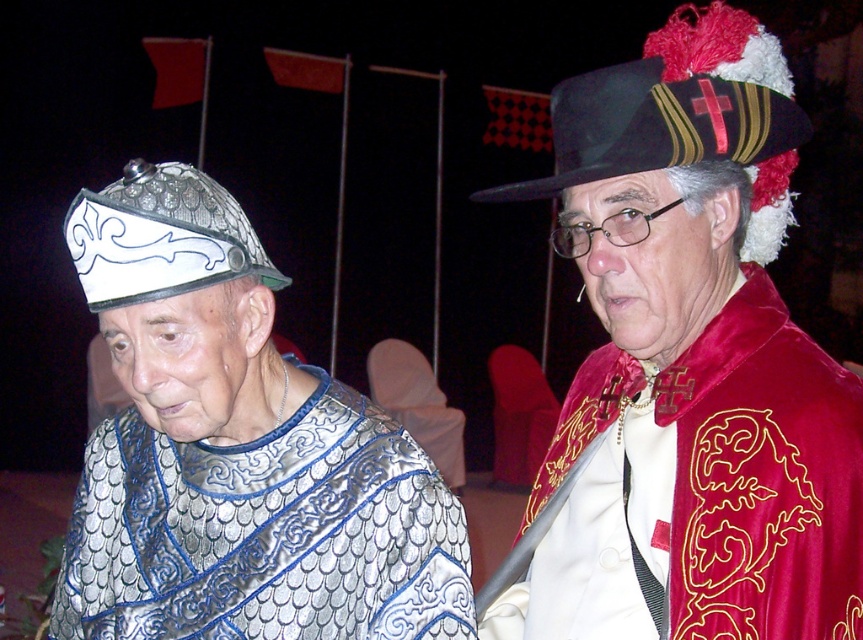
You are a photographer standing at the camera position. You want to capture a closeup shot of the velvet red cape at upper right without moving the camera. Is it possible to do so given its distance?

The velvet red cape at upper right is 4.10 feet away from the camera. If the photographer has a zoom lens capable of focusing on objects at that distance, then yes, a closeup shot is possible without moving the camera.

You are standing in front of the two costumed individuals. If you want to hand an item to the person wearing the metallic chainmail at left and the black felt hat at upper right, which one can you reach without moving closer?

The metallic chainmail at left is closer to the viewer than the black felt hat at upper right, so you can reach the person wearing the metallic chainmail at left without moving closer.

You are an event planner arranging a photo shoot for the two costumed individuals. You need to position them so that the velvet red cape at upper right does not block the view of the metallic chainmail at left. Based on their current positions, is this arrangement possible?

The velvet red cape at upper right is located above the metallic chainmail at left, so adjusting their positions slightly downward or backward could prevent the cape from blocking the view of the chainmail.